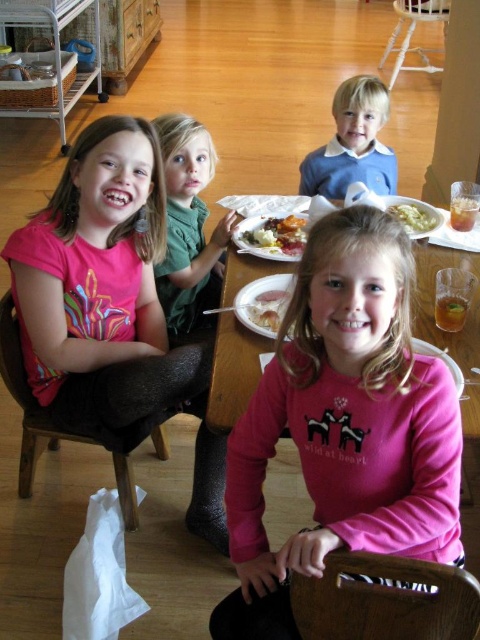
Does pink soft cotton shirt at center appear under brown wood chair at lower center?

No.

Between pink soft cotton shirt at center and brown wood chair at lower center, which one appears on the right side from the viewer's perspective?

Positioned to the right is brown wood chair at lower center.

Is point (220, 628) positioned in front of point (445, 605)?

That is False.

Locate an element on the screen. pink soft cotton shirt at center is located at coordinates (344, 426).

Is point (348, 113) closer to viewer compared to point (253, 300)?

No, it is not.

Between blue wool sweater at upper center and white creamy food at center, which one has less height?

Standing shorter between the two is white creamy food at center.

Identify the location of blue wool sweater at upper center. (352, 144).

Find the location of a particular element. blue wool sweater at upper center is located at coordinates (352, 144).

Does brown fabric chair at lower left have a smaller size compared to slightly browned bread at center?

Incorrect, brown fabric chair at lower left is not smaller in size than slightly browned bread at center.

Describe the element at coordinates (27, 403) in the screenshot. I see `brown fabric chair at lower left` at that location.

Where is `brown fabric chair at lower left`? Image resolution: width=480 pixels, height=640 pixels. brown fabric chair at lower left is located at coordinates (27, 403).